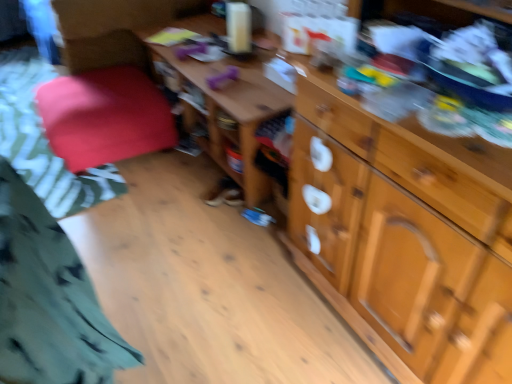
Locate an element on the screen. The image size is (512, 384). free space above wooden drawer at right (from a real-world perspective) is located at coordinates (431, 99).